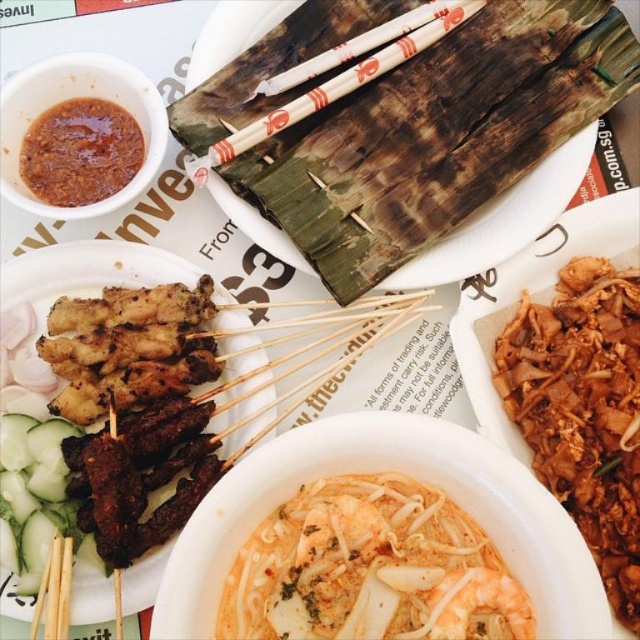
You are a food critic evaluating the presentation of this meal. The shiny orange noodles at center and wooden skewers at center are both central to the dish. Which of these two items has a smaller size?

The shiny orange noodles at center are smaller than the wooden skewers at center.